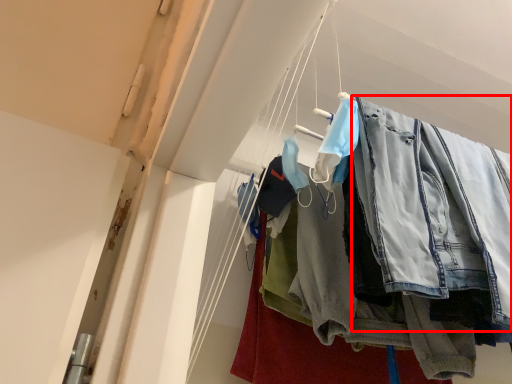
Question: From the image, what is the correct spatial relationship of clothing (annotated by the red box) in relation to trousers?

Choices:
 (A) right
 (B) left

Answer: (A)